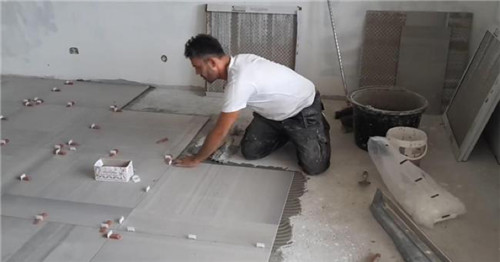
You are a GUI agent. You are given a task and a screenshot of the screen. Output one action in this format:
    pyautogui.click(x=<x>, y=<y>)
    Task: Click on the outlet
    This screenshot has width=500, height=262.
    Given the screenshot: What is the action you would take?
    pyautogui.click(x=72, y=67)